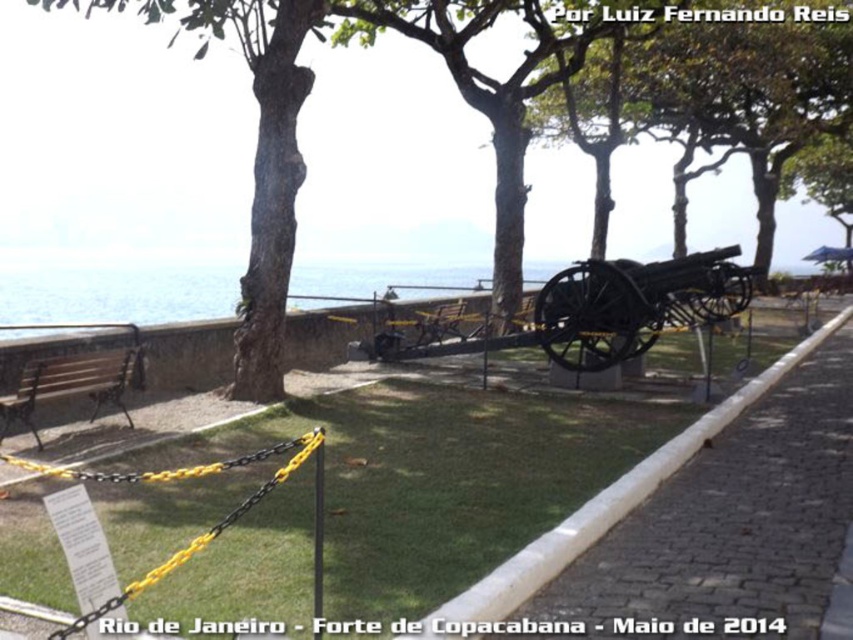
You are a tour guide explaining the historical site to a group. You mention the blue water at center and the black metal cannon at center. How far apart are these two landmarks?

The blue water at center is 10.56 meters away from the black metal cannon at center.

You are a visitor at this historical site and want to take a photo of both the blue water at center and the black metal cannon at center. Based on their positions, which object should you frame first in your camera viewfinder to ensure both are in the shot?

You should frame the black metal cannon at center first because the blue water at center is to the left of it, so positioning the cannon centrally will allow the water to be captured on its left side within the same frame.

You are standing at the entrance of the historical site and see two points marked on the ground. The first point is at point (463, 268) and the second is at point (20, 385). If you want to walk from the entrance to the cannon, which point should you step on first?

You should step on point (20, 385) first because point (463, 268) is behind it, meaning point (20, 385) is closer to the entrance.